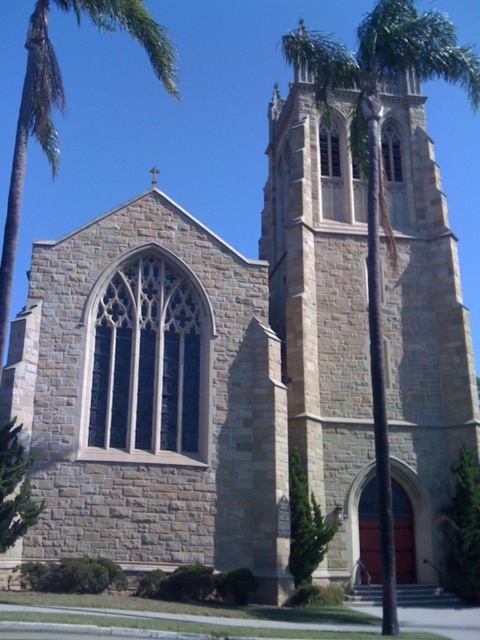
This screenshot has width=480, height=640. Describe the element at coordinates (381, 170) in the screenshot. I see `green leafy palm tree at center` at that location.

Who is positioned more to the right, green leafy palm tree at center or green leafy tree at center?

From the viewer's perspective, green leafy palm tree at center appears more on the right side.

Between point (383, 28) and point (466, 538), which one is positioned in front?

Point (383, 28)

The height and width of the screenshot is (640, 480). Find the location of `green leafy palm tree at center`. green leafy palm tree at center is located at coordinates (381, 170).

Which of these two, green leafy tree at center or green textured bush at lower center, stands shorter?

green textured bush at lower center is shorter.

Is point (462, 524) positioned after point (317, 541)?

Yes, point (462, 524) is behind point (317, 541).

What do you see at coordinates (463, 529) in the screenshot? I see `green leafy tree at center` at bounding box center [463, 529].

You are a GUI agent. You are given a task and a screenshot of the screen. Output one action in this format:
    pyautogui.click(x=<x>, y=<y>)
    Task: Click on the green leafy tree at center
    
    Given the screenshot: What is the action you would take?
    pyautogui.click(x=463, y=529)

Between green leafy palm tree at center and green textured bush at lower center, which one appears on the right side from the viewer's perspective?

green leafy palm tree at center is more to the right.

Is green leafy palm tree at center above green textured bush at lower center?

Yes.

Which is in front, point (423, 61) or point (303, 538)?

Point (303, 538) is in front.

At what (x,y) coordinates should I click in order to perform the action: click on green leafy palm tree at center. Please return your answer as a coordinate pair (x, y). Looking at the image, I should click on (381, 170).